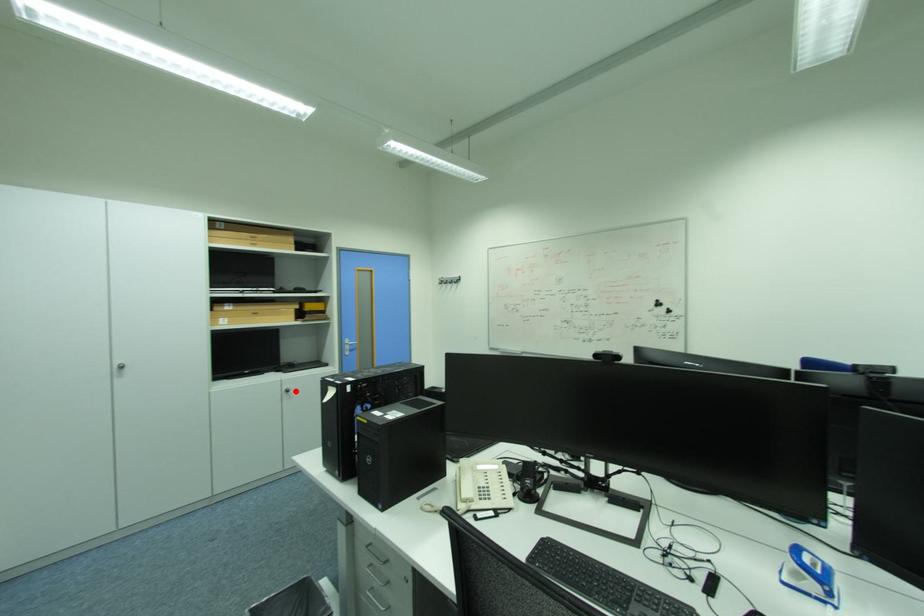
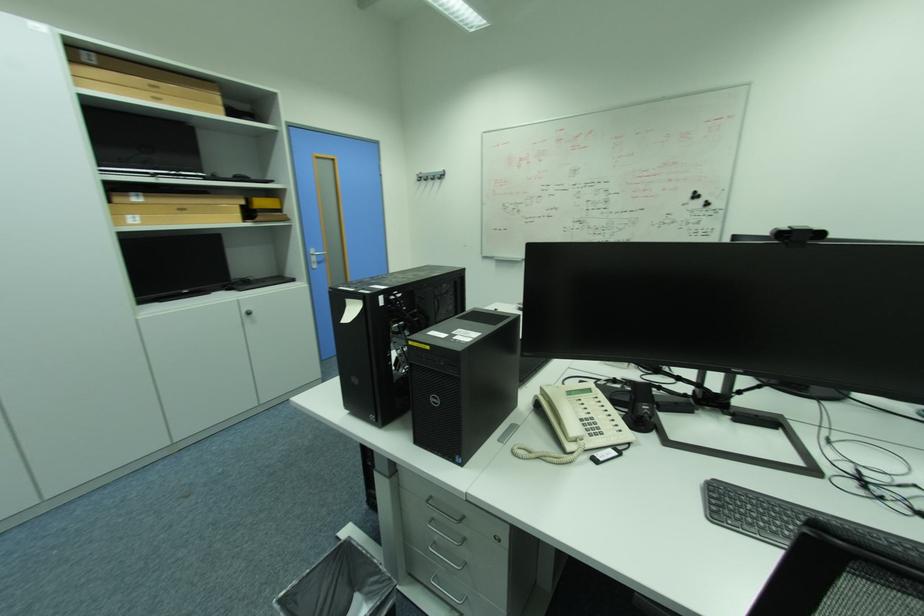
Where in the second image is the point corresponding to the highlighted location from the first image?

(257, 314)